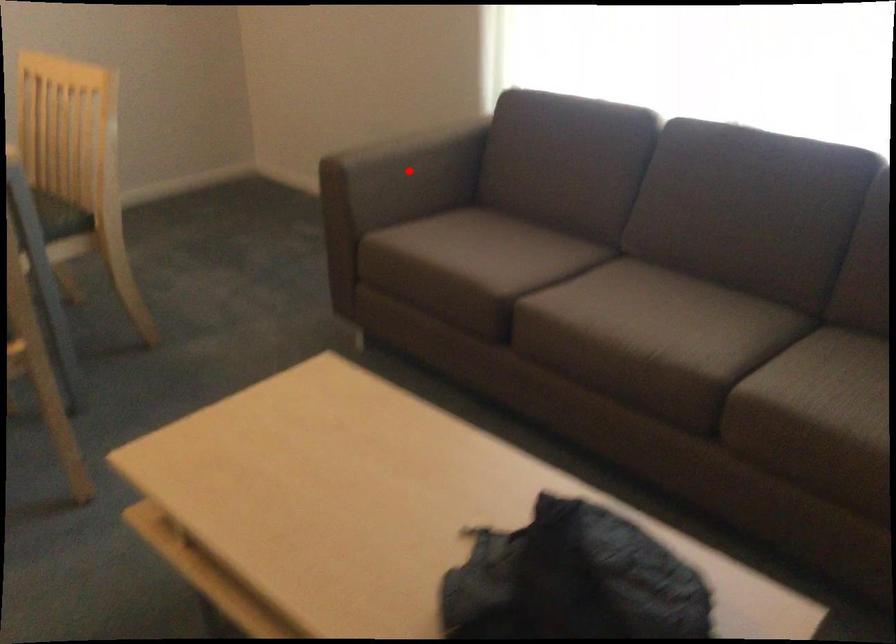
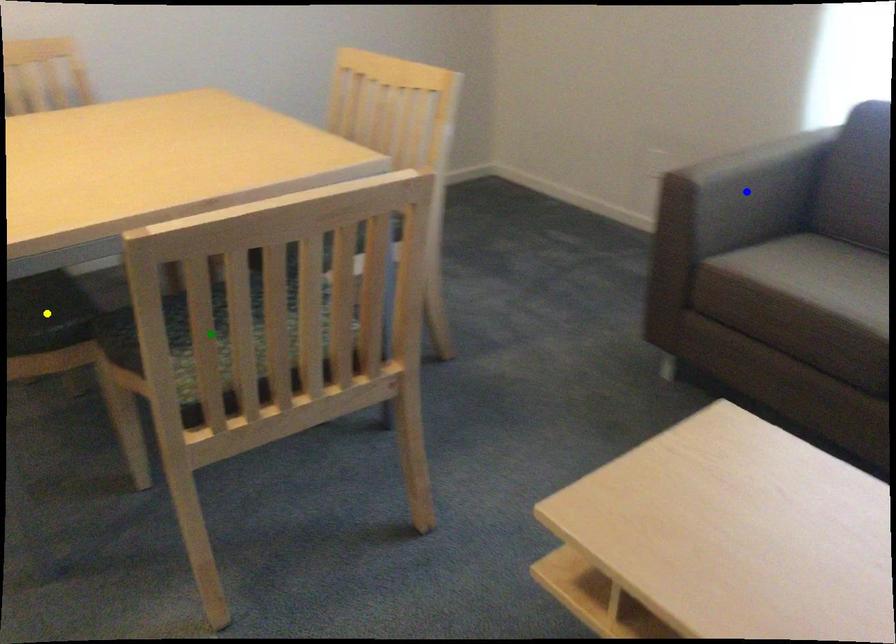
Question: I am providing you with two images of the same scene from different viewpoints. A red point is marked on the first image. You are given multiple points on the second image. Which point in image 2 represents the same 3d spot as the red point in image 1?

Choices:
 (A) green point
 (B) blue point
 (C) yellow point

Answer: (B)